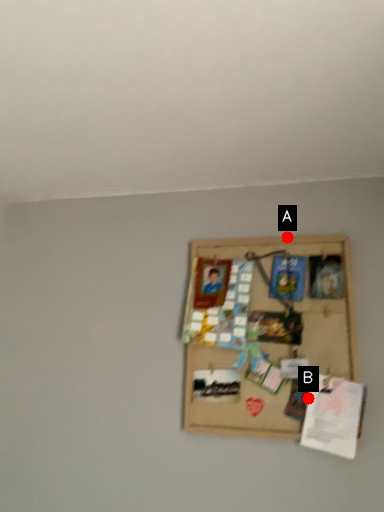
Question: Two points are circled on the image, labeled by A and B beside each circle. Among these points, which one is farthest from the camera?

Choices:
 (A) A is further
 (B) B is further

Answer: (A)